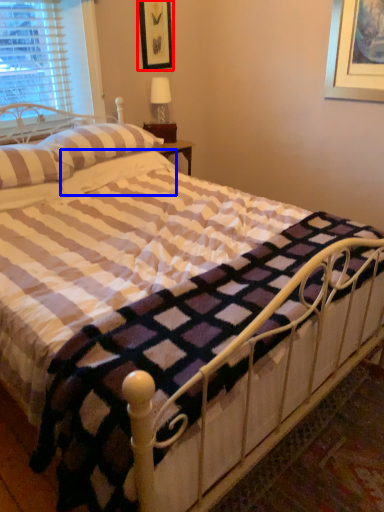
Question: Which object appears closest to the camera in this image, picture frame (highlighted by a red box) or pillow (highlighted by a blue box)?

Choices:
 (A) picture frame
 (B) pillow

Answer: (B)